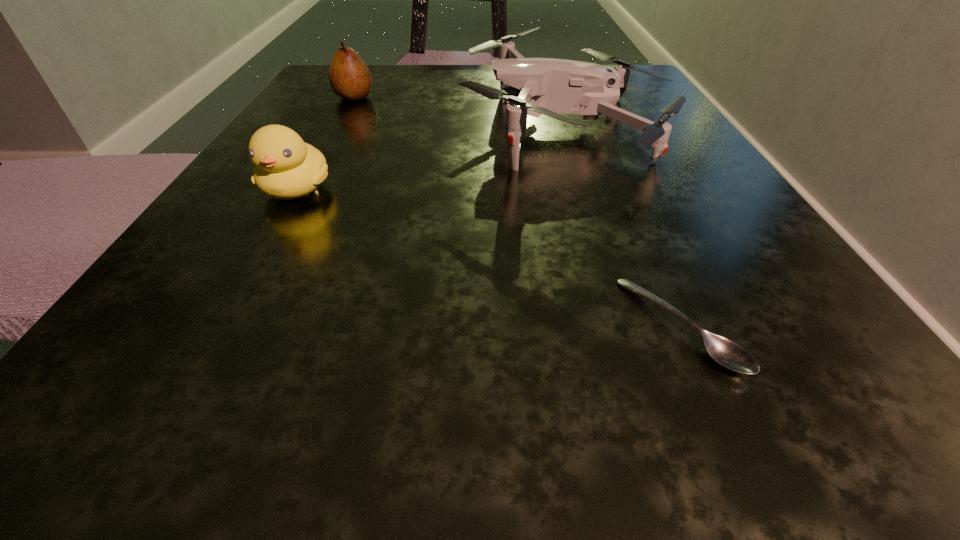
Locate an element on the screen. The height and width of the screenshot is (540, 960). object that is at the near right corner is located at coordinates (725, 352).

This screenshot has width=960, height=540. Identify the location of free spot at the far edge of the desktop. (456, 71).

Where is `free location at the near edge`? This screenshot has height=540, width=960. free location at the near edge is located at coordinates (584, 406).

Find the location of `free spot at the left edge of the desktop`. free spot at the left edge of the desktop is located at coordinates (366, 117).

Identify the location of blank space at the right edge of the desktop. The width and height of the screenshot is (960, 540). pyautogui.click(x=636, y=261).

Where is `vacant region at the far right corner`? vacant region at the far right corner is located at coordinates (640, 79).

The height and width of the screenshot is (540, 960). Find the location of `vacant area that lies between the pear and the drone`. vacant area that lies between the pear and the drone is located at coordinates (460, 111).

This screenshot has height=540, width=960. I want to click on free space between the drone and the shortest object, so click(x=622, y=225).

This screenshot has height=540, width=960. What are the coordinates of `empty location between the pear and the duckling` in the screenshot? It's located at (325, 144).

The width and height of the screenshot is (960, 540). I want to click on blank region between the pear and the duckling, so click(325, 144).